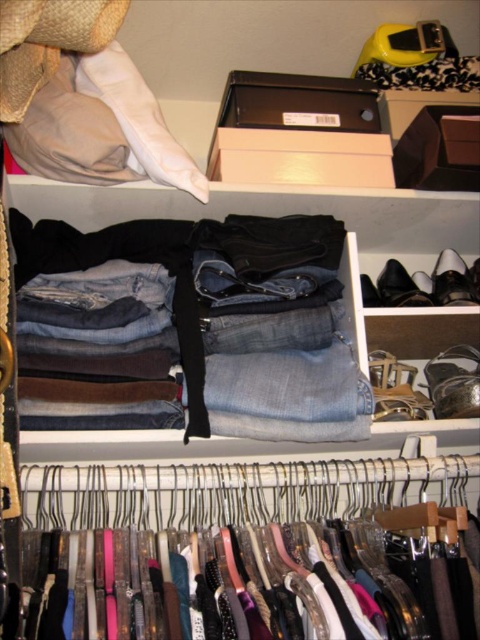
Question: Where is metallic hangers at center located in relation to denim jeans at center in the image?

Choices:
 (A) left
 (B) right

Answer: (B)

Question: Does metallic hangers at center have a larger size compared to denim jeans at center?

Choices:
 (A) no
 (B) yes

Answer: (B)

Question: Can you confirm if metallic hangers at center is positioned to the left of denim jeans at center?

Choices:
 (A) no
 (B) yes

Answer: (A)

Question: Which point is closer to the camera taking this photo?

Choices:
 (A) (216, 385)
 (B) (126, 516)

Answer: (A)

Question: Which object is farther from the camera taking this photo?

Choices:
 (A) denim jeans at center
 (B) metallic hangers at center

Answer: (A)